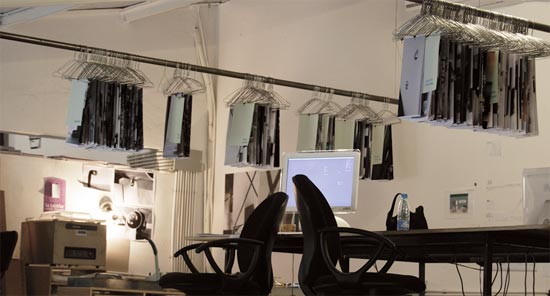
Identify the location of box. (46, 236).